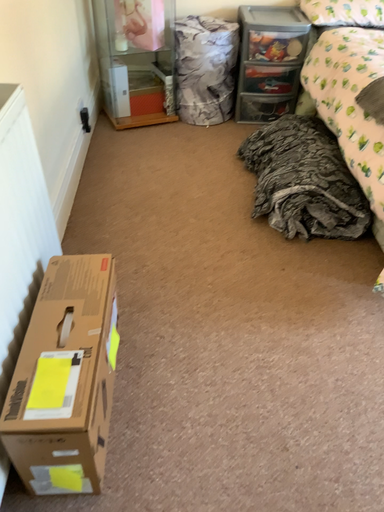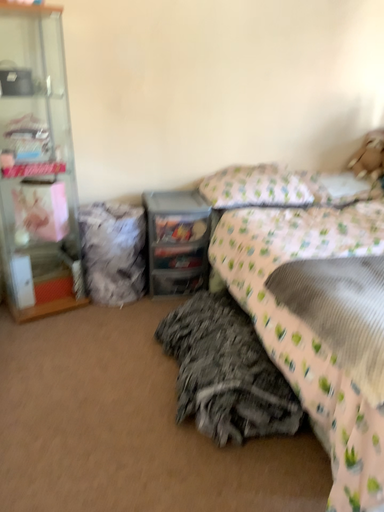
Question: Which way did the camera rotate in the video?

Choices:
 (A) rotated left
 (B) rotated right

Answer: (B)